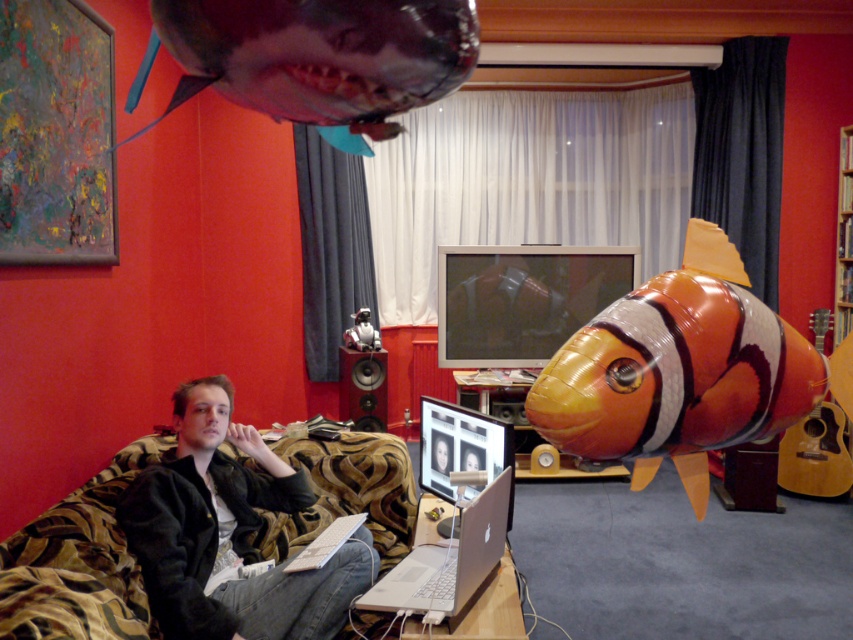
In the scene shown: You are standing in the living room and want to pick up the black leather jacket at lower left. If your outstretched arm can reach 1.5 meters, can you reach it without moving?

The black leather jacket at lower left is 1.87 meters away from the viewer. Since your arm can only reach 1.5 meters, you cannot reach it without moving closer.

You are planning to place a new small decorative item on the shelf next to the orange matte clownfish at right and the shiny metallic shark at upper center. Based on their sizes, which one can accommodate a smaller item next to it?

The shiny metallic shark at upper center can accommodate a smaller item next to it because the orange matte clownfish at right is larger in size than the shiny metallic shark at upper center.

Looking at this image, you are an interior designer planning to hang a new painting. You see the shiny metallic shark at upper center and the orange matte clownfish at right. Which object is closer to you?

The orange matte clownfish at right is closer to you because the shiny metallic shark at upper center is behind it.